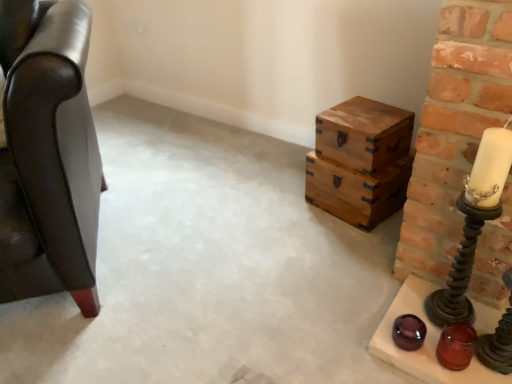
What do you see at coordinates (456, 346) in the screenshot?
I see `translucent glass candle holder at lower right, which appears as the first candle holder when ordered from the bottom` at bounding box center [456, 346].

You are a GUI agent. You are given a task and a screenshot of the screen. Output one action in this format:
    pyautogui.click(x=<x>, y=<y>)
    Task: Click on the wooden crates at right
    This screenshot has height=384, width=512.
    Given the screenshot: What is the action you would take?
    pyautogui.click(x=361, y=161)

What is the approximate height of wooden crates at right?

It is 24.77 centimeters.

The image size is (512, 384). Describe the element at coordinates (461, 268) in the screenshot. I see `metallic spiral candlestick at right, marked as the 3th candle holder in a bottom-to-top arrangement` at that location.

Find the location of a particular element. The image size is (512, 384). shiny dark brown candle holder at right, acting as the 2th candle holder starting from the top is located at coordinates (498, 338).

The height and width of the screenshot is (384, 512). What are the coordinates of `translucent glass candle holder at lower right, which appears as the third candle holder when viewed from the top` in the screenshot? It's located at (456, 346).

Which point is more forward, (375, 188) or (486, 347)?

The point (486, 347) is closer.

From the image's perspective, which object appears higher, wooden crates at right or shiny dark brown candle holder at right, acting as the 2th candle holder starting from the top?

wooden crates at right appears higher in the image.

Is wooden crates at right not close to shiny dark brown candle holder at right, acting as the 2th candle holder starting from the top?

No, there isn't a large distance between wooden crates at right and shiny dark brown candle holder at right, acting as the 2th candle holder starting from the top.

You are a GUI agent. You are given a task and a screenshot of the screen. Output one action in this format:
    pyautogui.click(x=<x>, y=<y>)
    Task: Click on the crate above the shiny dark brown candle holder at right, the second candle holder positioned from the bottom (from the image's perspective)
    
    Given the screenshot: What is the action you would take?
    pyautogui.click(x=361, y=161)

Considering the relative sizes of wooden crates at right and translucent glass candle holder at lower right, which appears as the first candle holder when ordered from the bottom, in the image provided, is wooden crates at right taller than translucent glass candle holder at lower right, which appears as the first candle holder when ordered from the bottom,?

Correct, wooden crates at right is much taller as translucent glass candle holder at lower right, which appears as the first candle holder when ordered from the bottom.

From a real-world perspective, which is physically below, wooden crates at right or translucent glass candle holder at lower right, which appears as the first candle holder when ordered from the bottom?

translucent glass candle holder at lower right, which appears as the first candle holder when ordered from the bottom.

Considering the sizes of objects wooden crates at right and translucent glass candle holder at lower right, which appears as the first candle holder when ordered from the bottom, in the image provided, who is bigger, wooden crates at right or translucent glass candle holder at lower right, which appears as the first candle holder when ordered from the bottom,?

wooden crates at right.

Could you tell me if wooden crates at right is facing translucent glass candle holder at lower right, which appears as the third candle holder when viewed from the top?

No.

From the picture: Is leather armchair at left further to the viewer compared to metallic spiral candlestick at right, marked as the first candle holder in a top-to-bottom arrangement?

No.

Is leather armchair at left to the left or to the right of metallic spiral candlestick at right, marked as the first candle holder in a top-to-bottom arrangement, in the image?

Based on their positions, leather armchair at left is located to the left of metallic spiral candlestick at right, marked as the first candle holder in a top-to-bottom arrangement.

Considering the points (65, 244) and (452, 284), which point is behind, point (65, 244) or point (452, 284)?

Point (452, 284)

From the image's perspective, is leather armchair at left beneath metallic spiral candlestick at right, marked as the 3th candle holder in a bottom-to-top arrangement?

No, from the image's perspective, leather armchair at left is not below metallic spiral candlestick at right, marked as the 3th candle holder in a bottom-to-top arrangement.

Who is taller, shiny dark brown candle holder at right, acting as the 2th candle holder starting from the top, or translucent glass candle holder at lower right, which appears as the third candle holder when viewed from the top?

Standing taller between the two is shiny dark brown candle holder at right, acting as the 2th candle holder starting from the top.

From a real-world perspective, does shiny dark brown candle holder at right, acting as the 2th candle holder starting from the top, stand above translucent glass candle holder at lower right, which appears as the first candle holder when ordered from the bottom?

Indeed, from a real-world perspective, shiny dark brown candle holder at right, acting as the 2th candle holder starting from the top, stands above translucent glass candle holder at lower right, which appears as the first candle holder when ordered from the bottom.

Is shiny dark brown candle holder at right, the second candle holder positioned from the bottom, not near translucent glass candle holder at lower right, which appears as the third candle holder when viewed from the top?

shiny dark brown candle holder at right, the second candle holder positioned from the bottom, is actually quite close to translucent glass candle holder at lower right, which appears as the third candle holder when viewed from the top.

Would you say translucent glass candle holder at lower right, which appears as the third candle holder when viewed from the top, is part of shiny dark brown candle holder at right, acting as the 2th candle holder starting from the top,'s contents?

No, shiny dark brown candle holder at right, acting as the 2th candle holder starting from the top, does not contain translucent glass candle holder at lower right, which appears as the third candle holder when viewed from the top.

The image size is (512, 384). I want to click on the 1st candle holder to the right of the wooden crates at right, starting your count from the anchor, so click(x=456, y=346).

Is the depth of translucent glass candle holder at lower right, which appears as the first candle holder when ordered from the bottom, less than that of wooden crates at right?

Yes, it is.

Which object is wider, translucent glass candle holder at lower right, which appears as the first candle holder when ordered from the bottom, or wooden crates at right?

Wider between the two is wooden crates at right.

In the scene shown: Is translucent glass candle holder at lower right, which appears as the first candle holder when ordered from the bottom, next to wooden crates at right?

No, translucent glass candle holder at lower right, which appears as the first candle holder when ordered from the bottom, is not touching wooden crates at right.

Which point is more forward, (472, 233) or (506, 326)?

The point (472, 233) is closer to the camera.

Which of these two, metallic spiral candlestick at right, marked as the 3th candle holder in a bottom-to-top arrangement, or shiny dark brown candle holder at right, acting as the 2th candle holder starting from the top, stands shorter?

Standing shorter between the two is shiny dark brown candle holder at right, acting as the 2th candle holder starting from the top.

Can we say metallic spiral candlestick at right, marked as the first candle holder in a top-to-bottom arrangement, lies outside shiny dark brown candle holder at right, acting as the 2th candle holder starting from the top?

That's correct, metallic spiral candlestick at right, marked as the first candle holder in a top-to-bottom arrangement, is outside of shiny dark brown candle holder at right, acting as the 2th candle holder starting from the top.

Between metallic spiral candlestick at right, marked as the 3th candle holder in a bottom-to-top arrangement, and shiny dark brown candle holder at right, the second candle holder positioned from the bottom, which one has smaller width?

metallic spiral candlestick at right, marked as the 3th candle holder in a bottom-to-top arrangement, is thinner.

I want to click on crate lying below the leather armchair at left (from the image's perspective), so click(361, 161).

From the picture: From their relative heights in the image, would you say wooden crates at right is taller or shorter than leather armchair at left?

In the image, wooden crates at right appears to be shorter than leather armchair at left.

Does point (378, 205) appear closer or farther from the camera than point (26, 257)?

Point (378, 205) appears to be farther away from the viewer than point (26, 257).

Between wooden crates at right and leather armchair at left, which one is positioned behind?

wooden crates at right.

What are the coordinates of `crate that appears below the shiny dark brown candle holder at right, acting as the 2th candle holder starting from the top (from a real-world perspective)` in the screenshot? It's located at (361, 161).

What are the coordinates of `crate above the translucent glass candle holder at lower right, which appears as the third candle holder when viewed from the top (from the image's perspective)` in the screenshot? It's located at (361, 161).

From the image, which object appears to be farther from metallic spiral candlestick at right, marked as the first candle holder in a top-to-bottom arrangement, wooden crates at right or shiny dark brown candle holder at right, acting as the 2th candle holder starting from the top?

wooden crates at right.

Looking at this image, from the image, which object appears to be farther from shiny dark brown candle holder at right, acting as the 2th candle holder starting from the top, leather armchair at left or metallic spiral candlestick at right, marked as the 3th candle holder in a bottom-to-top arrangement?

leather armchair at left lies further to shiny dark brown candle holder at right, acting as the 2th candle holder starting from the top, than the other object.

Looking at the image, which one is located closer to leather armchair at left, wooden crates at right or shiny dark brown candle holder at right, acting as the 2th candle holder starting from the top?

wooden crates at right is closer to leather armchair at left.

Consider the image. Looking at the image, which one is located further to leather armchair at left, metallic spiral candlestick at right, marked as the first candle holder in a top-to-bottom arrangement, or translucent glass candle holder at lower right, which appears as the third candle holder when viewed from the top?

translucent glass candle holder at lower right, which appears as the third candle holder when viewed from the top, is positioned further to the anchor leather armchair at left.

Based on their spatial positions, is wooden crates at right or metallic spiral candlestick at right, marked as the 3th candle holder in a bottom-to-top arrangement, further from translucent glass candle holder at lower right, which appears as the third candle holder when viewed from the top?

Among the two, wooden crates at right is located further to translucent glass candle holder at lower right, which appears as the third candle holder when viewed from the top.

Estimate the real-world distances between objects in this image. Which object is further from translucent glass candle holder at lower right, which appears as the first candle holder when ordered from the bottom, metallic spiral candlestick at right, marked as the 3th candle holder in a bottom-to-top arrangement, or shiny dark brown candle holder at right, acting as the 2th candle holder starting from the top?

metallic spiral candlestick at right, marked as the 3th candle holder in a bottom-to-top arrangement, is positioned further to the anchor translucent glass candle holder at lower right, which appears as the first candle holder when ordered from the bottom.

Which object lies further to the anchor point shiny dark brown candle holder at right, the second candle holder positioned from the bottom, wooden crates at right or leather armchair at left?

Based on the image, leather armchair at left appears to be further to shiny dark brown candle holder at right, the second candle holder positioned from the bottom.

From the image, which object appears to be farther from shiny dark brown candle holder at right, the second candle holder positioned from the bottom, wooden crates at right or translucent glass candle holder at lower right, which appears as the third candle holder when viewed from the top?

The object further to shiny dark brown candle holder at right, the second candle holder positioned from the bottom, is wooden crates at right.

Image resolution: width=512 pixels, height=384 pixels. In order to click on candle holder that lies between metallic spiral candlestick at right, marked as the 3th candle holder in a bottom-to-top arrangement, and translucent glass candle holder at lower right, which appears as the third candle holder when viewed from the top, from top to bottom in this screenshot , I will do `click(498, 338)`.

I want to click on crate between leather armchair at left and translucent glass candle holder at lower right, which appears as the first candle holder when ordered from the bottom, so click(x=361, y=161).

The height and width of the screenshot is (384, 512). Find the location of `candle holder between leather armchair at left and metallic spiral candlestick at right, marked as the 3th candle holder in a bottom-to-top arrangement`. candle holder between leather armchair at left and metallic spiral candlestick at right, marked as the 3th candle holder in a bottom-to-top arrangement is located at coordinates (456, 346).

Locate an element on the screen. The image size is (512, 384). candle holder between metallic spiral candlestick at right, marked as the 3th candle holder in a bottom-to-top arrangement, and wooden crates at right, along the z-axis is located at coordinates (456, 346).